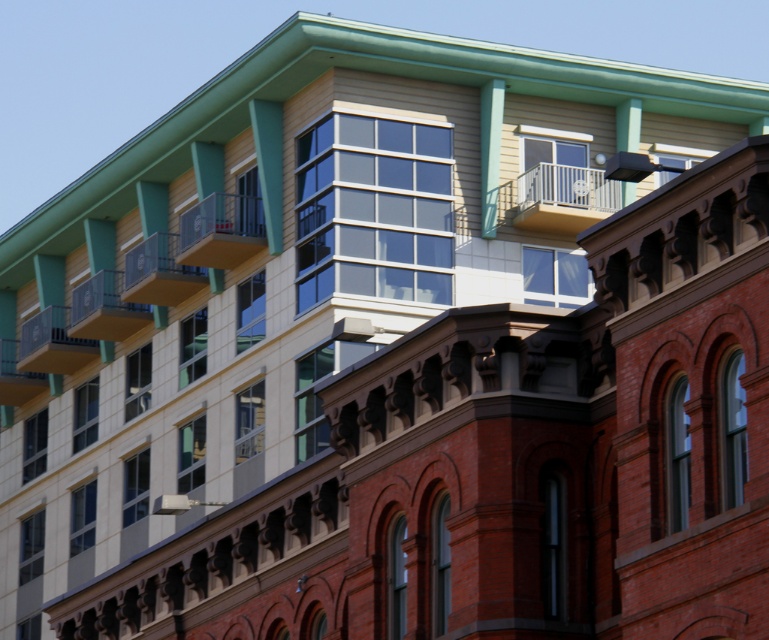
Question: Does white metal balcony at upper center have a greater width compared to wooden balcony at upper center?

Choices:
 (A) no
 (B) yes

Answer: (B)

Question: Which point is farther to the camera?

Choices:
 (A) white metal balcony at upper center
 (B) matte yellow balcony at upper center
 (C) wooden balcony at upper center
 (D) matte black balcony at upper left

Answer: (D)

Question: Which point appears farthest from the camera in this image?

Choices:
 (A) (95, 307)
 (B) (215, 234)
 (C) (132, 264)
 (D) (556, 166)

Answer: (A)

Question: Does wooden balcony at upper center lie in front of smooth black balcony at lower left?

Choices:
 (A) yes
 (B) no

Answer: (A)

Question: Which object appears farthest from the camera in this image?

Choices:
 (A) wooden balcony at upper center
 (B) smooth black balcony at lower left

Answer: (B)

Question: Can you confirm if white metal balcony at upper center is smaller than matte yellow balcony at upper center?

Choices:
 (A) no
 (B) yes

Answer: (A)